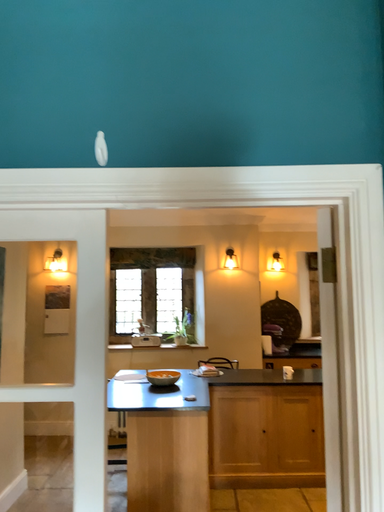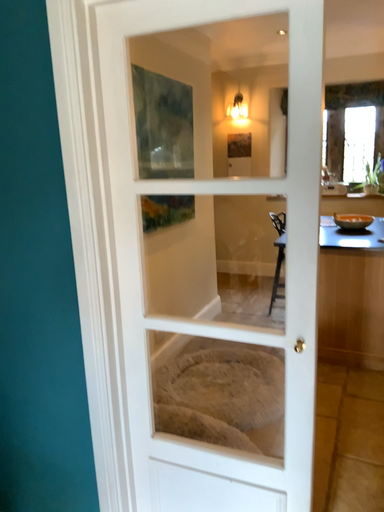
Question: How did the camera likely rotate when shooting the video?

Choices:
 (A) rotated upward
 (B) rotated downward

Answer: (B)